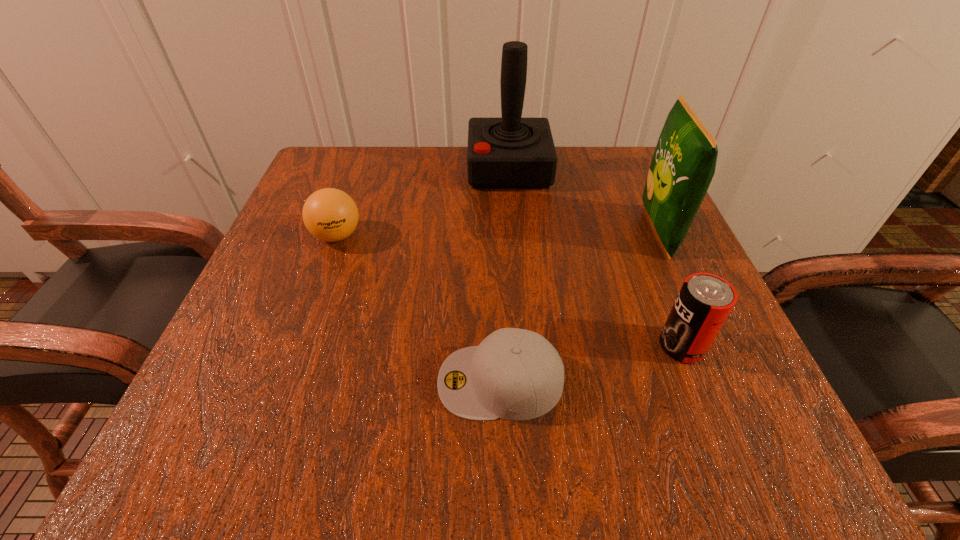
Identify the location of joystick. (511, 152).

Locate an element on the screen. This screenshot has height=540, width=960. crisp (potato chip) is located at coordinates 683,165.

Find the location of `the third shortest object`. the third shortest object is located at coordinates (704, 302).

At what (x,y) coordinates should I click in order to perform the action: click on ping-pong ball. Please return your answer as a coordinate pair (x, y). The width and height of the screenshot is (960, 540). Looking at the image, I should click on (329, 214).

At what (x,y) coordinates should I click in order to perform the action: click on the leftmost object. Please return your answer as a coordinate pair (x, y). This screenshot has height=540, width=960. Looking at the image, I should click on (329, 214).

At what (x,y) coordinates should I click in order to perform the action: click on the shortest object. Please return your answer as a coordinate pair (x, y). This screenshot has width=960, height=540. Looking at the image, I should click on (514, 374).

Identify the location of blank area located 0.100m on the base of the joystick. (424, 168).

At what (x,y) coordinates should I click in order to perform the action: click on free space located 0.150m on the base of the joystick. Please return your answer as a coordinate pair (x, y). The width and height of the screenshot is (960, 540). Looking at the image, I should click on (403, 168).

At what (x,y) coordinates should I click in order to perform the action: click on free space located 0.300m on the base of the joystick. Please return your answer as a coordinate pair (x, y). The height and width of the screenshot is (540, 960). Looking at the image, I should click on (337, 168).

You are a GUI agent. You are given a task and a screenshot of the screen. Output one action in this format:
    pyautogui.click(x=<x>, y=<y>)
    Task: Click on the vacant space located 0.060m on the front-facing side of the crisp (potato chip)
    The width and height of the screenshot is (960, 540).
    Given the screenshot: What is the action you would take?
    pyautogui.click(x=611, y=232)